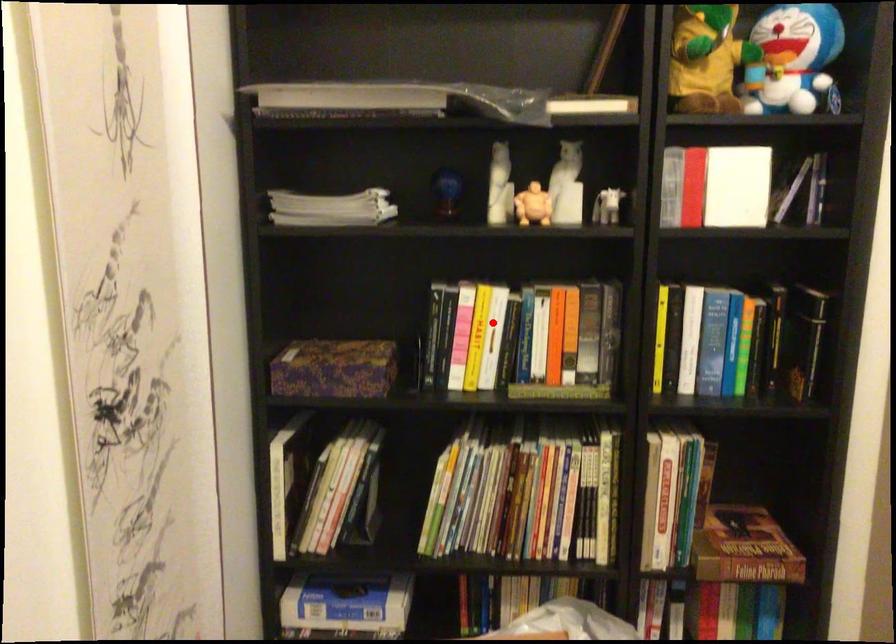
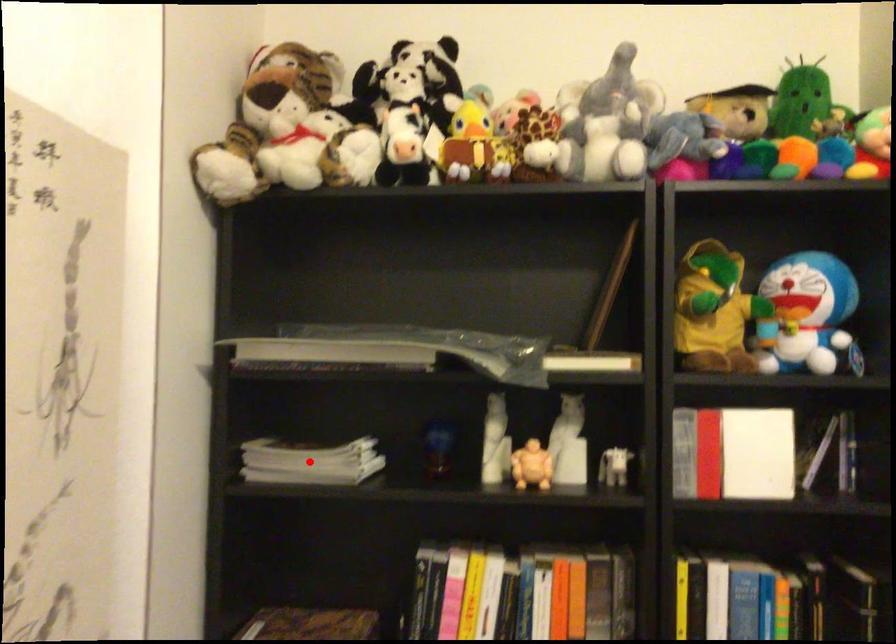
I am providing you with two images of the same scene from different viewpoints. A red point is marked on the first image and another point is marked on the second image. Is the marked point in image1 the same physical position as the marked point in image2?

No